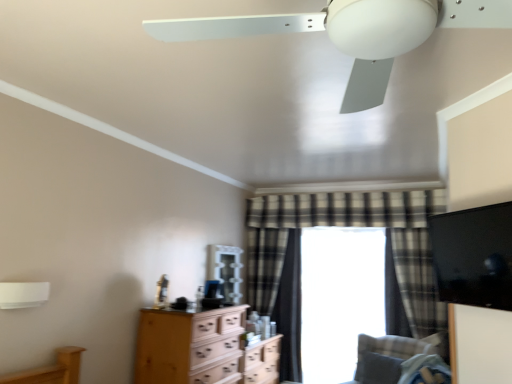
Question: Can you confirm if plaid fabric curtain at center, marked as the 3th curtain in a left-to-right arrangement, is smaller than white matte lamp at upper left?

Choices:
 (A) yes
 (B) no

Answer: (B)

Question: Is plaid fabric curtain at center, marked as the 3th curtain in a left-to-right arrangement, thinner than white matte lamp at upper left?

Choices:
 (A) yes
 (B) no

Answer: (B)

Question: Considering the relative sizes of plaid fabric curtain at center, marked as the 3th curtain in a left-to-right arrangement, and white matte lamp at upper left in the image provided, is plaid fabric curtain at center, marked as the 3th curtain in a left-to-right arrangement, shorter than white matte lamp at upper left?

Choices:
 (A) yes
 (B) no

Answer: (B)

Question: Can you confirm if plaid fabric curtain at center, marked as the 3th curtain in a left-to-right arrangement, is positioned to the right of white matte lamp at upper left?

Choices:
 (A) no
 (B) yes

Answer: (B)

Question: Could you tell me if plaid fabric curtain at center, positioned as the first curtain in right-to-left order, is turned towards white matte lamp at upper left?

Choices:
 (A) yes
 (B) no

Answer: (B)

Question: Based on their positions, is white matte ceiling fan at upper center located to the left or right of gray fabric pillow at lower right?

Choices:
 (A) left
 (B) right

Answer: (A)

Question: From a real-world perspective, is white matte ceiling fan at upper center positioned above or below gray fabric pillow at lower right?

Choices:
 (A) above
 (B) below

Answer: (A)

Question: Does point (366, 71) appear closer or farther from the camera than point (377, 372)?

Choices:
 (A) farther
 (B) closer

Answer: (B)

Question: Considering the positions of white matte ceiling fan at upper center and gray fabric pillow at lower right in the image, is white matte ceiling fan at upper center bigger or smaller than gray fabric pillow at lower right?

Choices:
 (A) small
 (B) big

Answer: (B)

Question: In the image, is gray fabric pillow at lower right positioned in front of or behind velvet gray swivel chair at lower right?

Choices:
 (A) front
 (B) behind

Answer: (B)

Question: Is gray fabric pillow at lower right to the left or to the right of velvet gray swivel chair at lower right in the image?

Choices:
 (A) left
 (B) right

Answer: (B)

Question: Do you think gray fabric pillow at lower right is within velvet gray swivel chair at lower right, or outside of it?

Choices:
 (A) inside
 (B) outside

Answer: (A)

Question: Is point (379, 359) closer or farther from the camera than point (443, 374)?

Choices:
 (A) farther
 (B) closer

Answer: (A)

Question: In terms of height, does white matte lamp at upper left look taller or shorter compared to plaid fabric curtain at center, the 3th curtain from the right?

Choices:
 (A) tall
 (B) short

Answer: (B)

Question: Is white matte lamp at upper left in front of or behind plaid fabric curtain at center, placed as the 1th curtain when sorted from left to right, in the image?

Choices:
 (A) behind
 (B) front

Answer: (B)